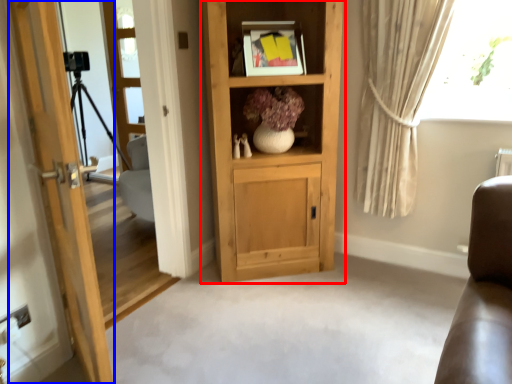
Question: Which object is closer to the camera taking this photo, cabinetry (highlighted by a red box) or door (highlighted by a blue box)?

Choices:
 (A) cabinetry
 (B) door

Answer: (B)